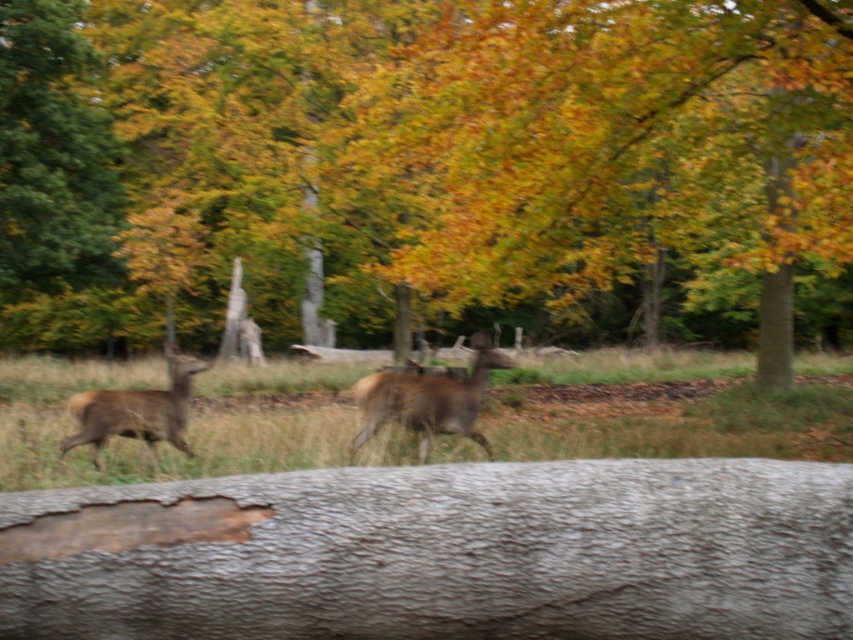
Based on the photo, you are a hiker who wants to cross a stream using the logs provided. The brown textured log at center and the smooth gray log at center are both positioned across the stream. Which log would you choose to walk on for better stability and why?

The brown textured log at center is bigger and has a rough surface, providing better stability compared to the smooth gray log at center which is smaller and smoother.

You are a hiker navigating through the autumnal forest and want to step over the logs. Which log should you step over first, the brown textured log at center or the smooth gray log at center?

You should step over the brown textured log at center first because the smooth gray log at center is behind it, making the brown textured log at center closer to you.